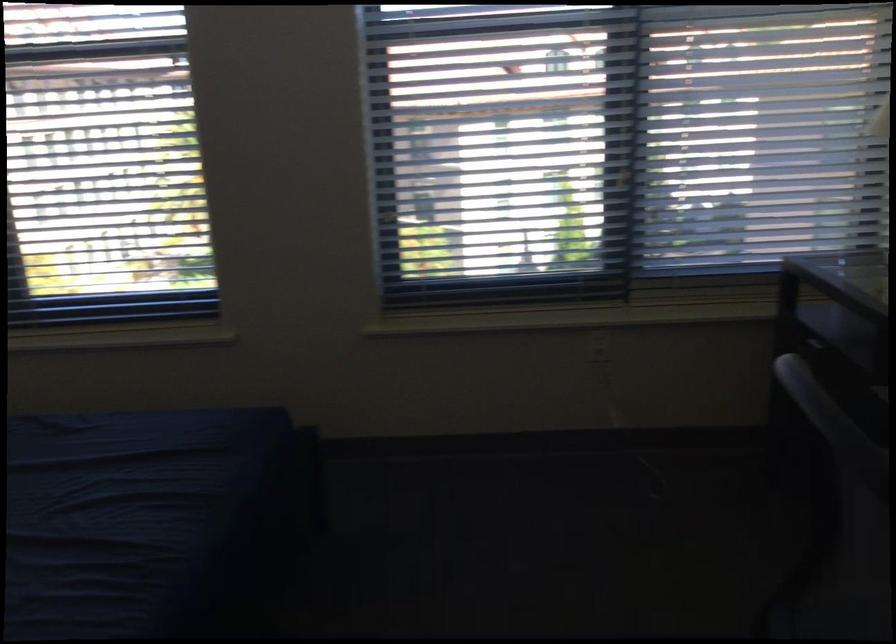
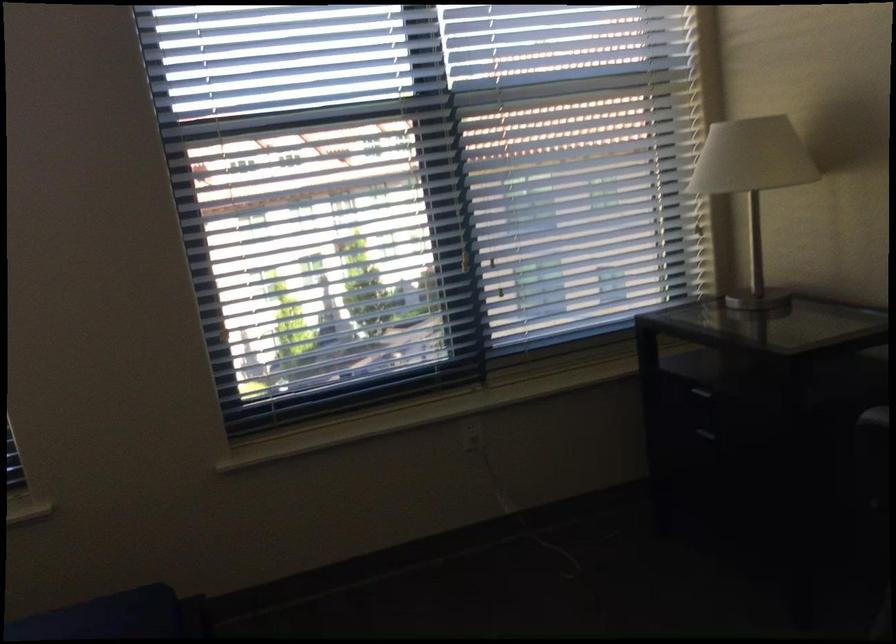
Find the pixel in the second image that matches pixel 599 343 in the first image.

(471, 433)